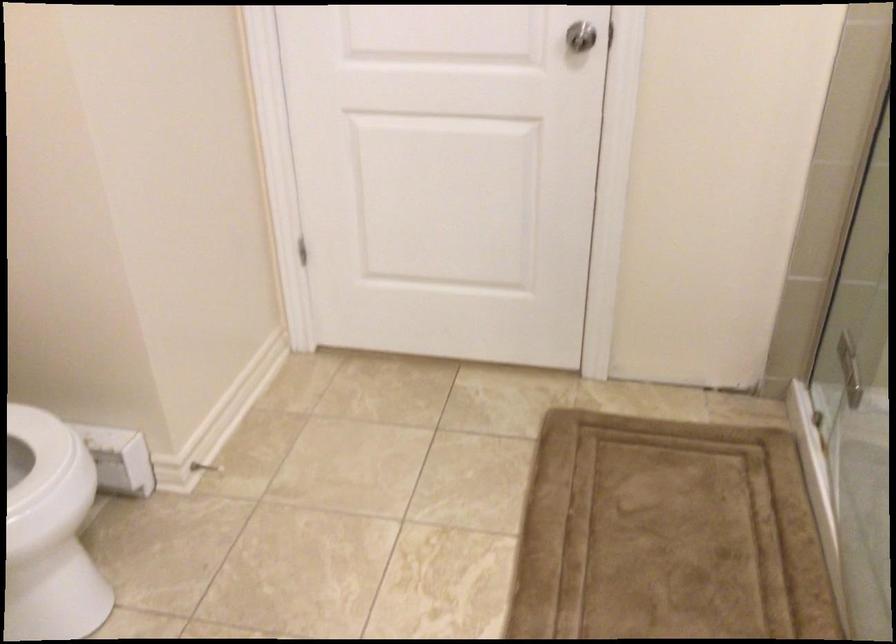
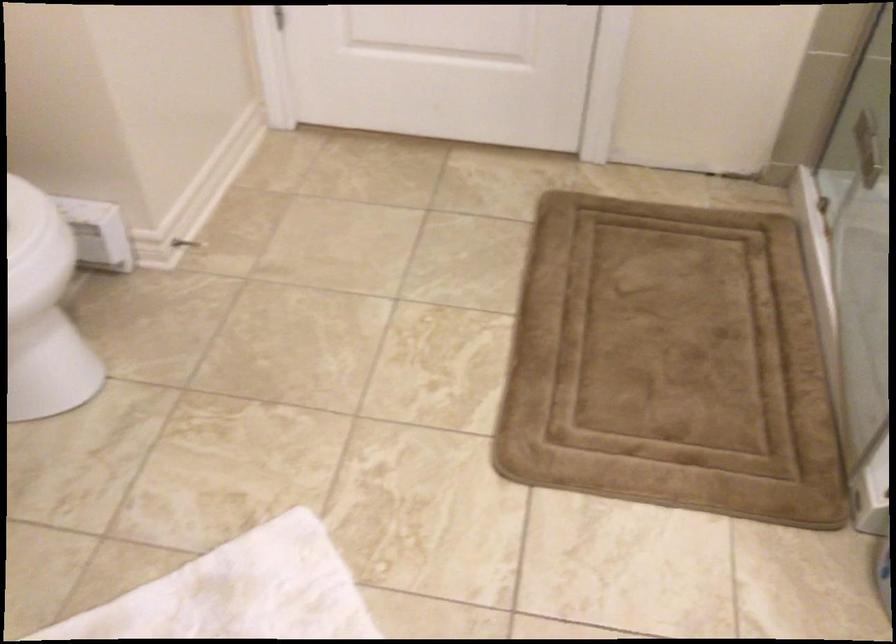
What movement of the cameraman would produce the second image?

The cameraman moved toward left, forward.